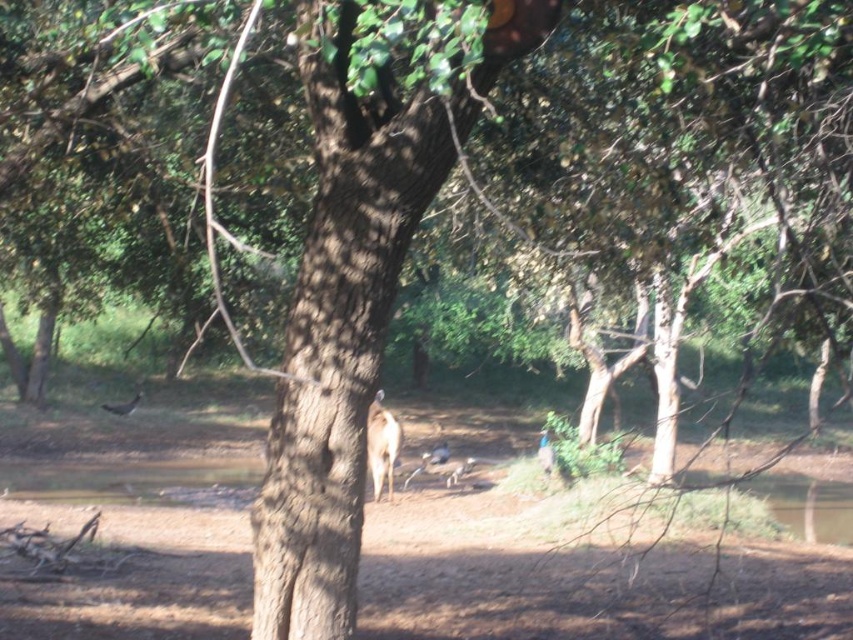
You are standing in the forest scene described. There is a point labeled at coordinates (381,445). What animal is located at that point?

The point at coordinates (381,445) corresponds to a brown furry deer at center.

You are standing in a forest near a water body and see the scene described. There is a point at coordinates (337, 330). What object is located at that point?

The point at coordinates (337, 330) marks the brown rough tree trunk at center.

You are an animal tracker observing the forest scene. You notice both the brown furry deer at center and the brown fur antelope at center. Which animal is higher up in the image?

The brown furry deer at center is positioned over brown fur antelope at center, so the deer is higher up in the image.